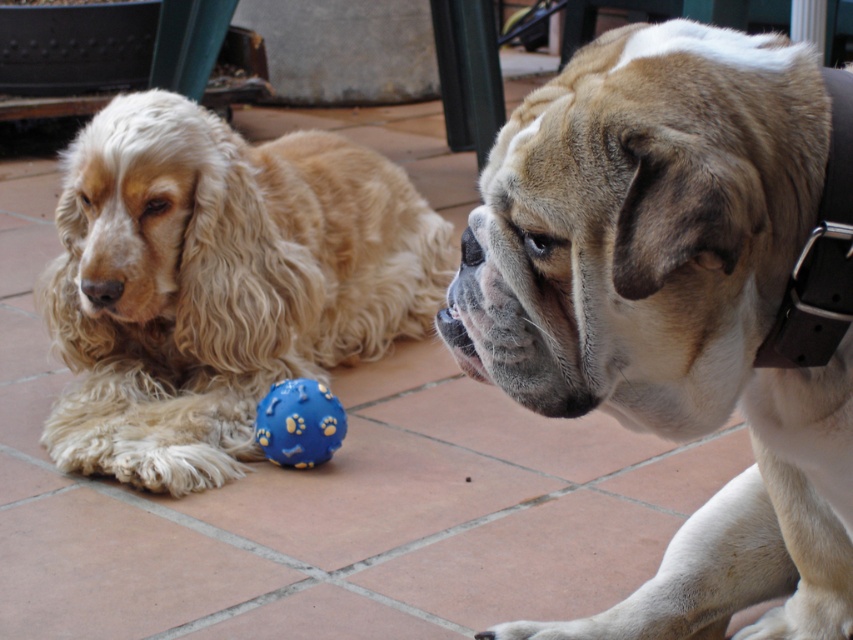
Question: Can you confirm if blue rubber ball at center is positioned above black rubber nose at center?

Choices:
 (A) no
 (B) yes

Answer: (A)

Question: Estimate the real-world distances between objects in this image. Which object is farther from the blue rubber ball at center?

Choices:
 (A) black rubber nose at center
 (B) golden fur dog at left
 (C) brown leather collar at center

Answer: (C)

Question: Can you confirm if golden fur dog at left is positioned below blue rubber ball at center?

Choices:
 (A) yes
 (B) no

Answer: (B)

Question: Which is farther from the blue rubber ball at center?

Choices:
 (A) brown leather collar at center
 (B) golden fur dog at left
 (C) black rubber nose at center

Answer: (A)

Question: Considering the relative positions of golden fur dog at left and blue rubber ball at center in the image provided, where is golden fur dog at left located with respect to blue rubber ball at center?

Choices:
 (A) below
 (B) above

Answer: (B)

Question: Which of the following is the closest to the observer?

Choices:
 (A) blue rubber ball at center
 (B) black rubber nose at center

Answer: (B)